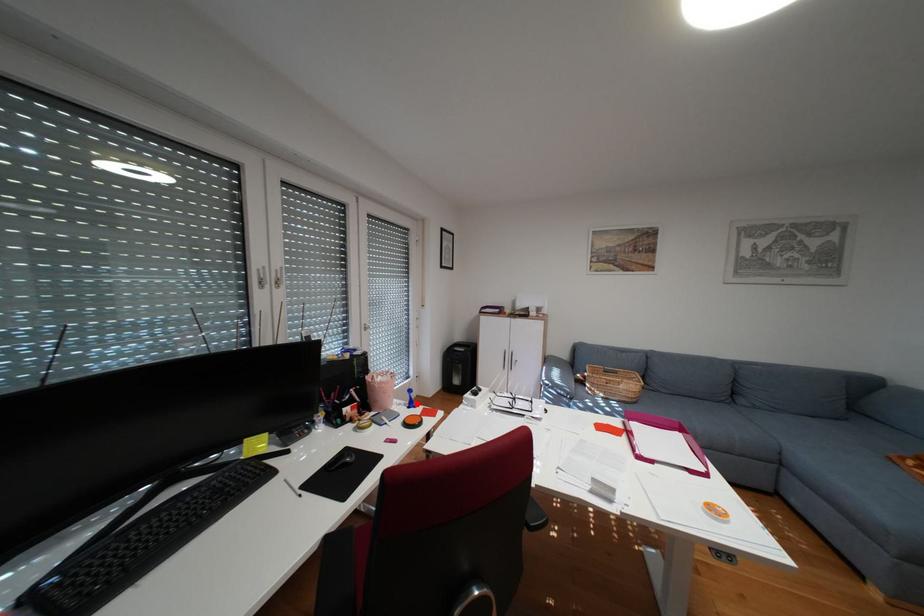
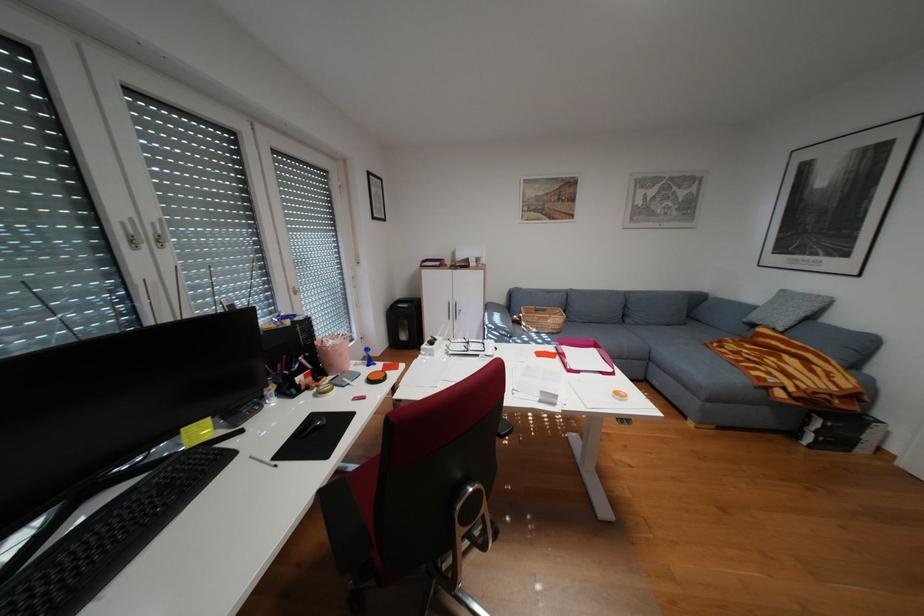
Question: I am providing you with two images of the same scene from different viewpoints. Image1 has a red point marked. In image2, the corresponding 3D location appears at what relative position? Reply with the corresponding letter.

Choices:
 (A) Closer
 (B) Farther

Answer: (B)